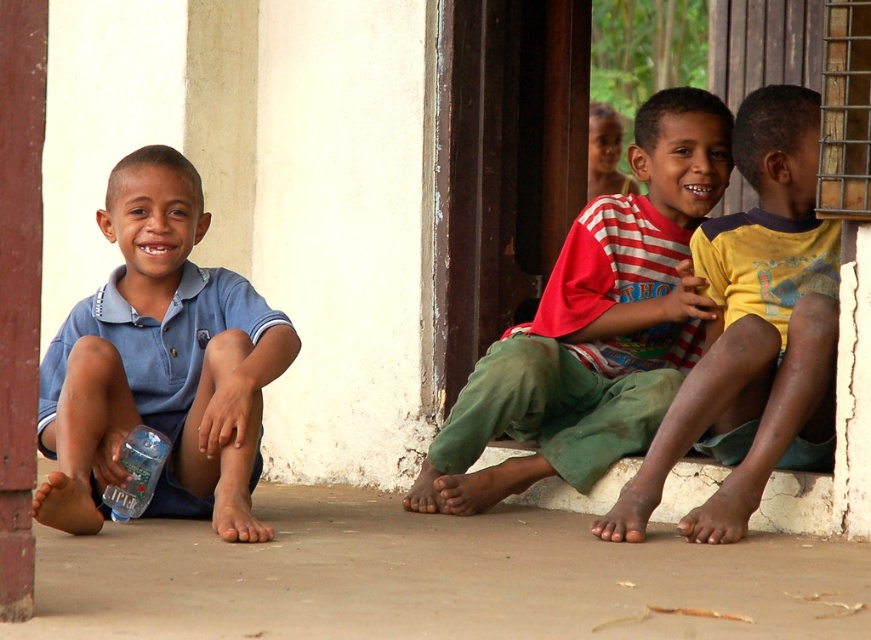
You are a photographer trying to capture a closeup of the yellow cotton shirt at center and the clear plastic bottle at lower left. Which object should you zoom in on first to ensure it fits entirely in the frame?

The clear plastic bottle at lower left is smaller in size than the yellow cotton shirt at center, so you should zoom in on the clear plastic bottle at lower left first to ensure it fits entirely in the frame.

You are a photographer trying to capture a candid shot of the red striped shirt at center and the clear plastic bottle at lower left. Since you want both subjects to appear proportionally sized in the photo, which subject should you move closer to the camera?

The red striped shirt at center is larger in size than the clear plastic bottle at lower left, so to make them appear proportionally sized in the photo, you should move closer to the clear plastic bottle at lower left. This will magnify its size in the frame, balancing it with the already larger red striped shirt at center.